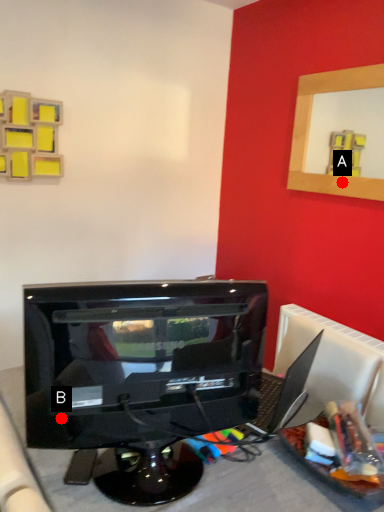
Question: Two points are circled on the image, labeled by A and B beside each circle. Among these points, which one is farthest from the camera?

Choices:
 (A) A is further
 (B) B is further

Answer: (A)